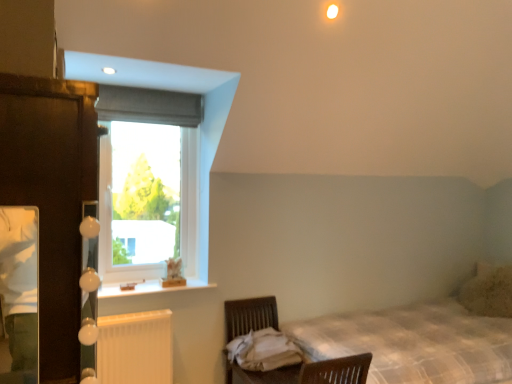
Image resolution: width=512 pixels, height=384 pixels. I want to click on clear glass window at upper left, so click(148, 185).

In order to click on beige textured pillow at right in this screenshot , I will do `click(488, 291)`.

Which object is closer to the camera taking this photo, beige textured pillow at right or wooden swivel chair at lower center?

wooden swivel chair at lower center is more forward.

From the image's perspective, which one is positioned higher, beige textured pillow at right or wooden swivel chair at lower center?

beige textured pillow at right, from the image's perspective.

Between point (490, 285) and point (263, 325), which one is positioned behind?

The point (490, 285) is more distant.

Can you tell me how much beige textured pillow at right and wooden swivel chair at lower center differ in facing direction?

90.6 degrees separate the facing orientations of beige textured pillow at right and wooden swivel chair at lower center.

Would you say plaid fabric bed at lower right is to the left or to the right of white plastic radiator at lower left in the picture?

Based on their positions, plaid fabric bed at lower right is located to the right of white plastic radiator at lower left.

From the image's perspective, which is above, plaid fabric bed at lower right or white plastic radiator at lower left?

white plastic radiator at lower left is shown above in the image.

From a real-world perspective, between plaid fabric bed at lower right and white plastic radiator at lower left, who is vertically higher?

From a 3D spatial view, white plastic radiator at lower left is above.

Visually, is clear glass window at upper left positioned to the left or to the right of white wood at upper left?

Clearly, clear glass window at upper left is on the left of white wood at upper left in the image.

From the image's perspective, between clear glass window at upper left and white wood at upper left, which one is located above?

clear glass window at upper left appears higher in the image.

Would you say clear glass window at upper left is outside white wood at upper left?

Indeed, clear glass window at upper left is completely outside white wood at upper left.

Looking at this image, between clear glass window at upper left and white wood at upper left, which one is positioned in front?

white wood at upper left is more forward.

Is plaid fabric bed at lower right far from dark wood armoire at left?

Yes, plaid fabric bed at lower right and dark wood armoire at left are quite far apart.

Identify the location of bed to the right of dark wood armoire at left. (398, 347).

Looking at this image, is the depth of plaid fabric bed at lower right less than that of dark wood armoire at left?

No, the depth of plaid fabric bed at lower right is greater than that of dark wood armoire at left.

Identify the location of bed below the clear glass window at upper left (from a real-world perspective). The image size is (512, 384). (398, 347).

Does point (162, 273) lie behind point (254, 377)?

Yes, point (162, 273) is farther from viewer.

From a real-world perspective, does clear glass window at upper left sit lower than plaid fabric bed at lower right?

Incorrect, from a real-world perspective, clear glass window at upper left is higher than plaid fabric bed at lower right.

From the image's perspective, would you say clear glass window at upper left is shown under plaid fabric bed at lower right?

No.

Who is shorter, beige textured pillow at right or dark wood armoire at left?

beige textured pillow at right is shorter.

How many degrees apart are the facing directions of beige textured pillow at right and dark wood armoire at left?

179 degrees.

Can dark wood armoire at left be found inside beige textured pillow at right?

No, beige textured pillow at right does not contain dark wood armoire at left.

Who is smaller, clear glass window at upper left or beige textured pillow at right?

With smaller size is beige textured pillow at right.

Is beige textured pillow at right at the back of clear glass window at upper left?

No, beige textured pillow at right is not at the back of clear glass window at upper left.

From the picture: Measure the distance from clear glass window at upper left to beige textured pillow at right.

The distance of clear glass window at upper left from beige textured pillow at right is 8.38 feet.

From a real-world perspective, is clear glass window at upper left positioned over beige textured pillow at right based on gravity?

Yes, from a real-world perspective, clear glass window at upper left is above beige textured pillow at right.

You are a GUI agent. You are given a task and a screenshot of the screen. Output one action in this format:
    pyautogui.click(x=<x>, y=<y>)
    Task: Click on the swivel chair in front of the beige textured pillow at right
    The height and width of the screenshot is (384, 512).
    Given the screenshot: What is the action you would take?
    pyautogui.click(x=250, y=315)

You are a GUI agent. You are given a task and a screenshot of the screen. Output one action in this format:
    pyautogui.click(x=<x>, y=<y>)
    Task: Click on the radiator on the left side of plaid fabric bed at lower right
    The height and width of the screenshot is (384, 512).
    Given the screenshot: What is the action you would take?
    pyautogui.click(x=135, y=348)

Based on their spatial positions, is white plastic radiator at lower left or plaid fabric bed at lower right further from beige textured pillow at right?

white plastic radiator at lower left is further to beige textured pillow at right.

Looking at the image, which one is located further to white wood at upper left, beige textured pillow at right or wooden swivel chair at lower center?

beige textured pillow at right is further to white wood at upper left.

Considering their positions, is dark wood armoire at left positioned further to beige textured pillow at right than white wood at upper left?

Based on the image, dark wood armoire at left appears to be further to beige textured pillow at right.

From the image, which object appears to be nearer to clear glass window at upper left, white wood at upper left or beige textured pillow at right?

The object closer to clear glass window at upper left is white wood at upper left.

Looking at the image, which one is located closer to white plastic radiator at lower left, plaid fabric bed at lower right or white wood at upper left?

Among the two, white wood at upper left is located nearer to white plastic radiator at lower left.

Looking at the image, which one is located closer to white plastic radiator at lower left, beige textured pillow at right or dark wood armoire at left?

Based on the image, dark wood armoire at left appears to be nearer to white plastic radiator at lower left.

Looking at this image, which object lies nearer to the anchor point white plastic radiator at lower left, plaid fabric bed at lower right or wooden swivel chair at lower center?

wooden swivel chair at lower center lies closer to white plastic radiator at lower left than the other object.

Looking at the image, which one is located further to dark wood armoire at left, plaid fabric bed at lower right or clear glass window at upper left?

plaid fabric bed at lower right.

Where is `radiator between dark wood armoire at left and clear glass window at upper left from front to back`? The image size is (512, 384). radiator between dark wood armoire at left and clear glass window at upper left from front to back is located at coordinates (135, 348).

Where is `swivel chair between white wood at upper left and beige textured pillow at right in the horizontal direction`? This screenshot has width=512, height=384. swivel chair between white wood at upper left and beige textured pillow at right in the horizontal direction is located at coordinates point(250,315).

The image size is (512, 384). I want to click on bed located between clear glass window at upper left and beige textured pillow at right in the left-right direction, so click(398, 347).

Identify the location of window sill between clear glass window at upper left and plaid fabric bed at lower right from left to right. (149, 288).